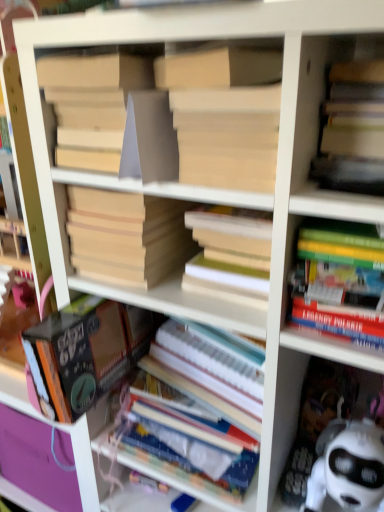
Question: From the image's perspective, would you say white paper at center, marked as the sixth book in a top-to-bottom arrangement, is positioned over matte yellow book at upper right, marked as the 2th book in a top-to-bottom arrangement?

Choices:
 (A) yes
 (B) no

Answer: (B)

Question: Is the depth of white paper at center, the 1th book when ordered from bottom to top, greater than that of matte yellow book at upper right, the 5th book positioned from the bottom?

Choices:
 (A) no
 (B) yes

Answer: (B)

Question: From the image's perspective, is white paper at center, the 1th book when ordered from bottom to top, under matte yellow book at upper right, the 5th book positioned from the bottom?

Choices:
 (A) yes
 (B) no

Answer: (A)

Question: Is white paper at center, marked as the sixth book in a top-to-bottom arrangement, closer to camera compared to matte yellow book at upper right, marked as the 2th book in a top-to-bottom arrangement?

Choices:
 (A) no
 (B) yes

Answer: (A)

Question: Can you confirm if white paper at center, the 1th book when ordered from bottom to top, is bigger than matte yellow book at upper right, marked as the 2th book in a top-to-bottom arrangement?

Choices:
 (A) no
 (B) yes

Answer: (B)

Question: Is matte yellow book at upper right, marked as the 2th book in a top-to-bottom arrangement, in front of or behind hardcover books at right, the third book in the bottom-to-top sequence, in the image?

Choices:
 (A) front
 (B) behind

Answer: (A)

Question: Would you say matte yellow book at upper right, the 5th book positioned from the bottom, is to the left or to the right of hardcover books at right, the third book in the bottom-to-top sequence, in the picture?

Choices:
 (A) left
 (B) right

Answer: (B)

Question: Which is correct: matte yellow book at upper right, the 5th book positioned from the bottom, is inside hardcover books at right, which ranks as the fourth book in top-to-bottom order, or outside of it?

Choices:
 (A) outside
 (B) inside

Answer: (A)

Question: Looking at their shapes, would you say matte yellow book at upper right, the 5th book positioned from the bottom, is wider or thinner than hardcover books at right, which ranks as the fourth book in top-to-bottom order?

Choices:
 (A) wide
 (B) thin

Answer: (A)

Question: Considering their positions, is hardcover book at center, which is the second book from bottom to top, located in front of or behind beige cardboard book at center, marked as the 4th book in a bottom-to-top arrangement?

Choices:
 (A) front
 (B) behind

Answer: (A)

Question: Looking at their shapes, would you say hardcover book at center, which is the second book from bottom to top, is wider or thinner than beige cardboard book at center, the third book viewed from the top?

Choices:
 (A) thin
 (B) wide

Answer: (B)

Question: Does point coord(117,347) appear closer or farther from the camera than point coord(71,234)?

Choices:
 (A) closer
 (B) farther

Answer: (B)

Question: Do you think hardcover book at center, which is the fifth book from top to bottom, is within beige cardboard book at center, the third book viewed from the top, or outside of it?

Choices:
 (A) inside
 (B) outside

Answer: (B)

Question: From the image's perspective, relative to beige cardboard book at center, marked as the 4th book in a bottom-to-top arrangement, is matte yellow book at upper right, the 5th book positioned from the bottom, above or below?

Choices:
 (A) below
 (B) above

Answer: (B)

Question: Would you say matte yellow book at upper right, marked as the 2th book in a top-to-bottom arrangement, is to the left or to the right of beige cardboard book at center, marked as the 4th book in a bottom-to-top arrangement, in the picture?

Choices:
 (A) right
 (B) left

Answer: (A)